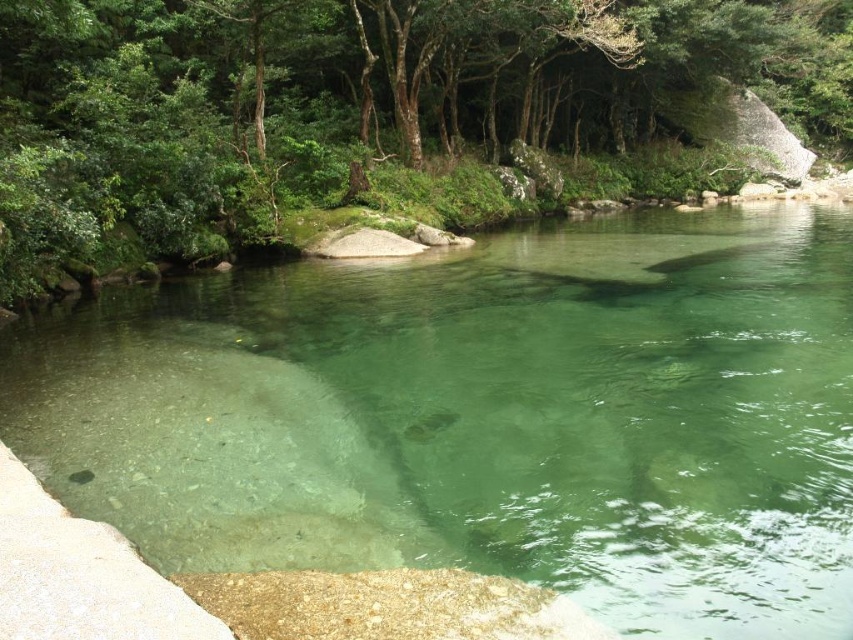
Does clear glassy water at center have a greater height compared to green leafy tree at upper center?

No.

Which of these two, clear glassy water at center or green leafy tree at upper center, stands shorter?

clear glassy water at center is shorter.

The height and width of the screenshot is (640, 853). I want to click on clear glassy water at center, so click(485, 417).